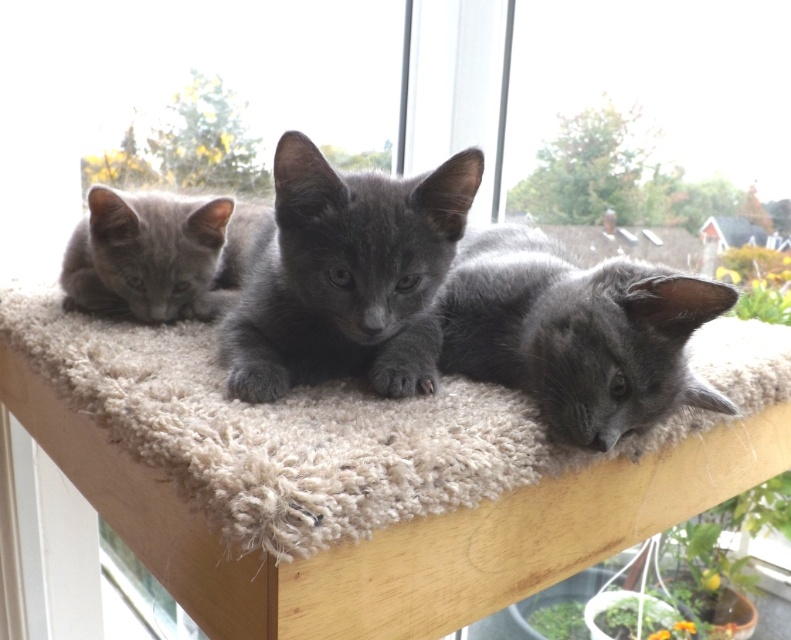
You are a cat owner who wants to buy a collar for your kittens. The shiny black kitten at center and the shiny gray kitten at center are both in need of collars. Given their sizes, which kitten requires a smaller collar?

The shiny black kitten at center requires a smaller collar because it has a smaller size compared to the shiny gray kitten at center.

You are a cat owner who wants to place a small toy between the shiny black kitten at center and the shiny gray kitten at center. The toy requires a minimum of 7 inches of space to fit. Based on the kittens current positions, will the toy fit between them?

The shiny black kitten at center is 6.76 inches away from the shiny gray kitten at center. Since the required space for the toy is 7 inches, the distance between them is insufficient, so the toy will not fit.